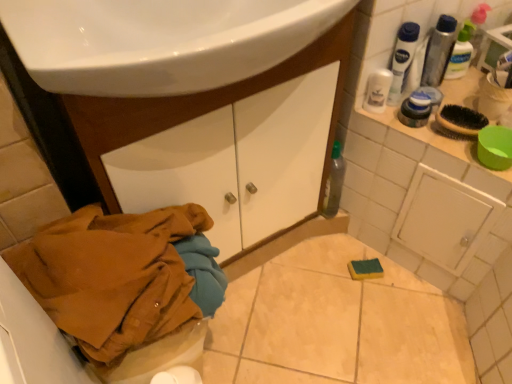
Identify the location of free space in front of translucent plastic mouthwash at upper right, placed as the first mouthwash when sorted from right to left. (458, 101).